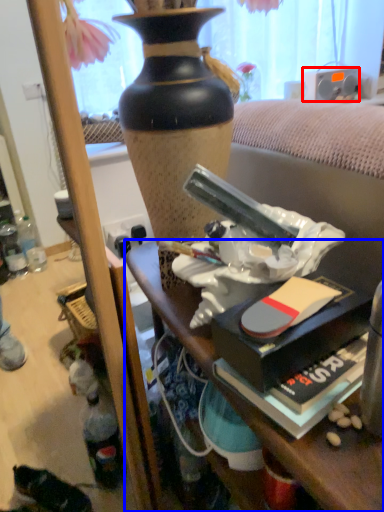
Question: Which object is closer to the camera taking this photo, loudspeaker (highlighted by a red box) or desk (highlighted by a blue box)?

Choices:
 (A) loudspeaker
 (B) desk

Answer: (B)